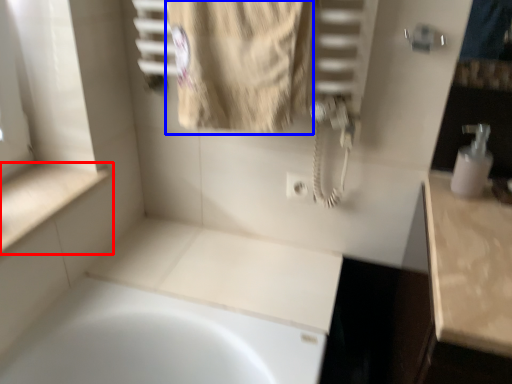
Question: Which point is further to the camera, counter top (highlighted by a red box) or bath towel (highlighted by a blue box)?

Choices:
 (A) counter top
 (B) bath towel

Answer: (A)